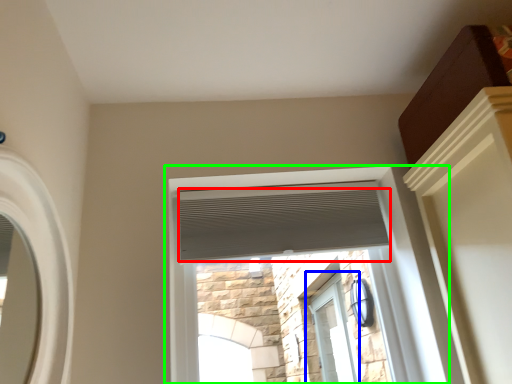
Question: Which is nearer to the blind (highlighted by a red box)? window (highlighted by a blue box) or window (highlighted by a green box).

Choices:
 (A) window
 (B) window

Answer: (B)